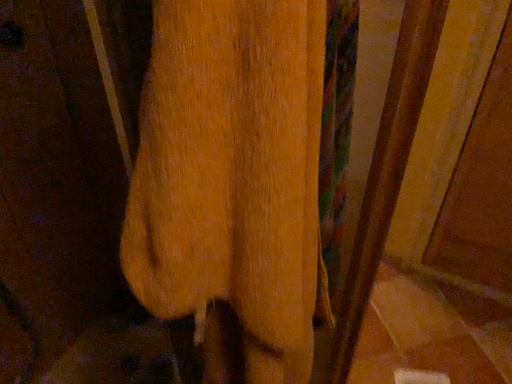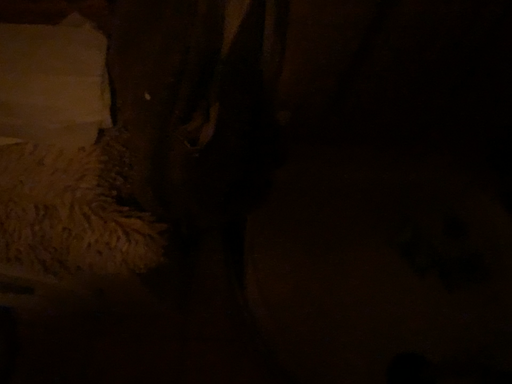
Question: How did the camera likely rotate when shooting the video?

Choices:
 (A) rotated right
 (B) rotated left

Answer: (B)